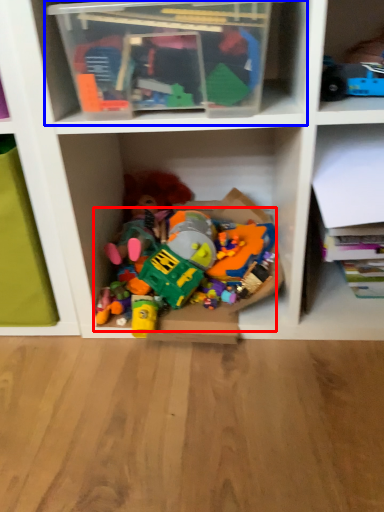
Question: Which object appears farthest to the camera in this image, toy (highlighted by a red box) or shelf (highlighted by a blue box)?

Choices:
 (A) toy
 (B) shelf

Answer: (A)